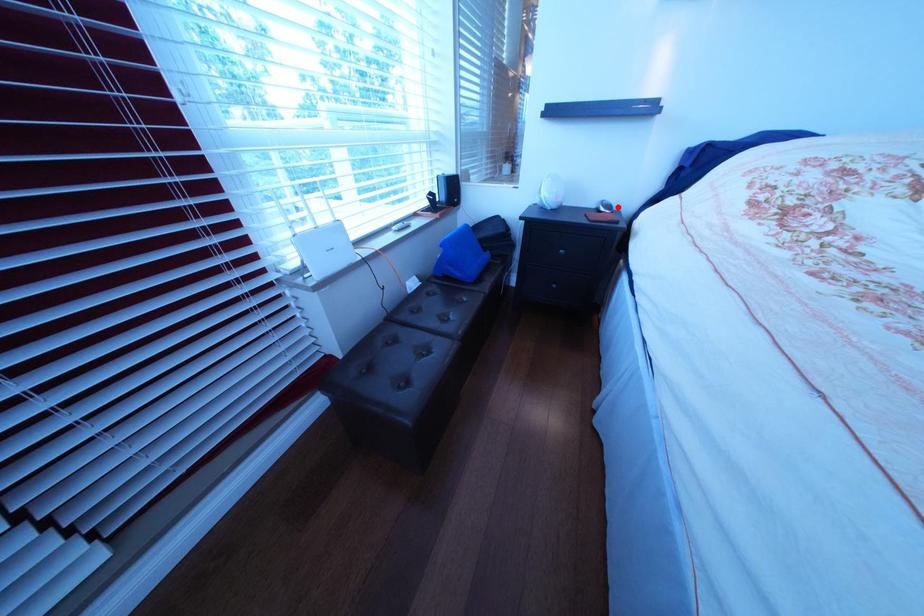
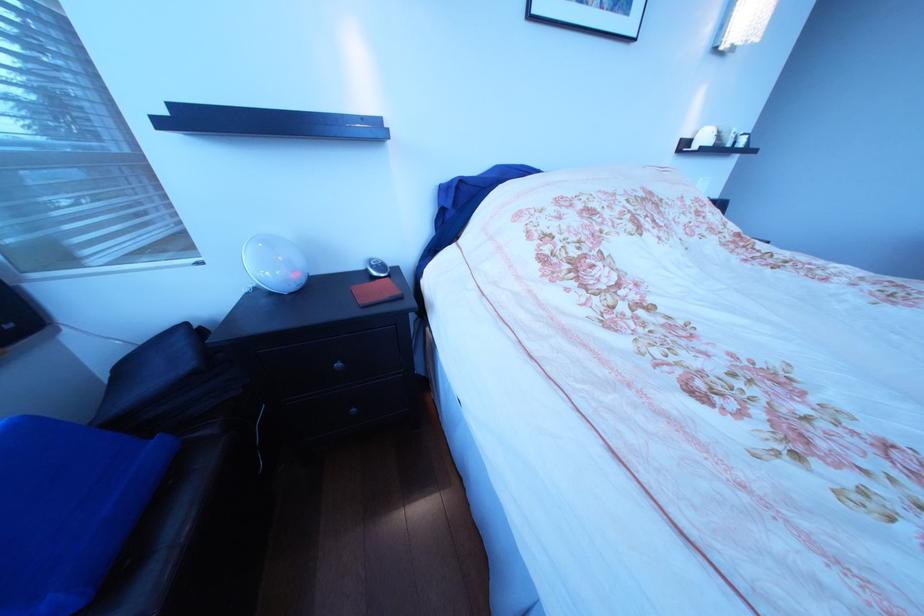
The point at the highlighted location is marked in the first image. Where is the corresponding point in the second image?

(387, 268)